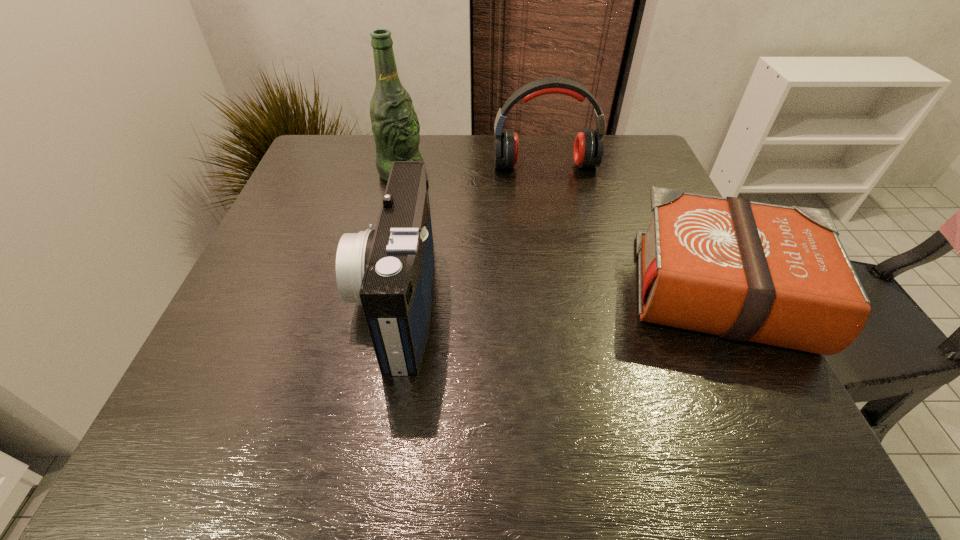
I want to click on object present at the far right corner, so click(x=588, y=148).

Identify the location of object present at the near right corner. The image size is (960, 540). (747, 271).

Locate an element on the screen. This screenshot has height=540, width=960. free space at the far edge of the desktop is located at coordinates (457, 146).

In the image, there is a desktop. Identify the location of free space at the near edge. (529, 372).

Identify the location of free space at the left edge of the desktop. (229, 330).

Locate an element on the screen. free region at the right edge of the desktop is located at coordinates (674, 333).

Find the location of a particular element. vacant space at the far left corner is located at coordinates (347, 165).

Identify the location of vacant space at the far right corner of the desktop. (644, 174).

The width and height of the screenshot is (960, 540). I want to click on free space at the near right corner of the desktop, so click(684, 401).

Where is `unoccupied area between the earphone and the tallest object`? unoccupied area between the earphone and the tallest object is located at coordinates (473, 169).